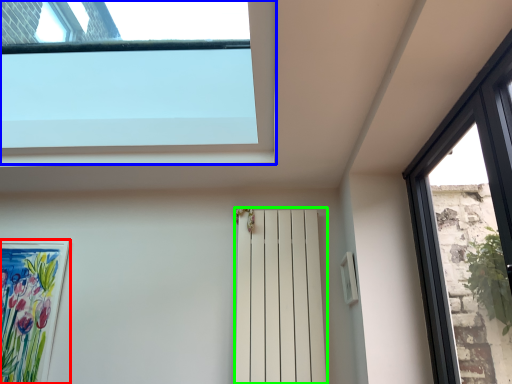
Question: Based on their relative distances, which object is nearer to picture frame (highlighted by a red box)? Choose from window (highlighted by a blue box) and shutter (highlighted by a green box).

Choices:
 (A) window
 (B) shutter

Answer: (A)